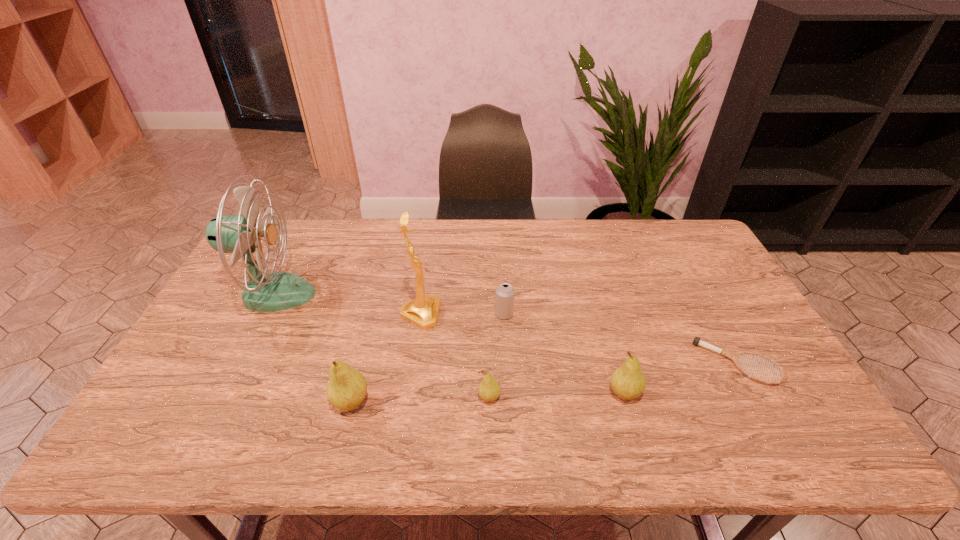
The height and width of the screenshot is (540, 960). I want to click on the leftmost pear, so click(x=346, y=390).

I want to click on the second pear from left to right, so click(x=489, y=390).

The height and width of the screenshot is (540, 960). Identify the location of the second shortest pear. (628, 382).

Locate an element on the screen. the fourth tallest object is located at coordinates (628, 382).

Locate an element on the screen. This screenshot has height=540, width=960. beer can is located at coordinates (504, 294).

Image resolution: width=960 pixels, height=540 pixels. Find the location of `the shortest object`. the shortest object is located at coordinates (733, 356).

You are a GUI agent. You are given a task and a screenshot of the screen. Output one action in this format:
    pyautogui.click(x=<x>, y=<y>)
    Task: Click on the tennis racket
    The image size is (960, 540).
    Given the screenshot: What is the action you would take?
    pyautogui.click(x=733, y=356)

What are the coordinates of `the leftmost object` in the screenshot? It's located at (265, 291).

What are the coordinates of `award` in the screenshot? It's located at (423, 312).

The image size is (960, 540). In order to click on vacant area located 0.250m on the left of the sixth object from right to left in this screenshot , I will do `click(229, 402)`.